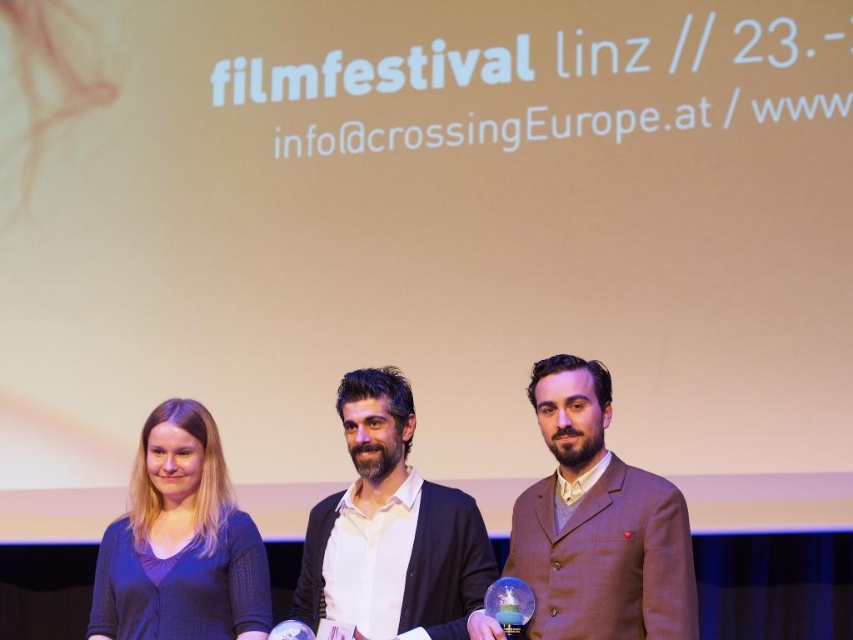
Question: In this image, where is brown wool suit at center located relative to white matte shirt at center?

Choices:
 (A) below
 (B) above

Answer: (B)

Question: Can you confirm if brown wool suit at center is bigger than dark blue sweater at left?

Choices:
 (A) yes
 (B) no

Answer: (A)

Question: Which object is closer to the camera taking this photo?

Choices:
 (A) dark blue sweater at left
 (B) white matte shirt at center

Answer: (B)

Question: Which point is farther from the camera taking this photo?

Choices:
 (A) (575, 548)
 (B) (169, 596)

Answer: (B)

Question: Where is brown wool suit at center located in relation to dark blue sweater at left in the image?

Choices:
 (A) right
 (B) left

Answer: (A)

Question: Which of the following is the farthest from the observer?

Choices:
 (A) brown wool suit at center
 (B) dark blue sweater at left

Answer: (B)